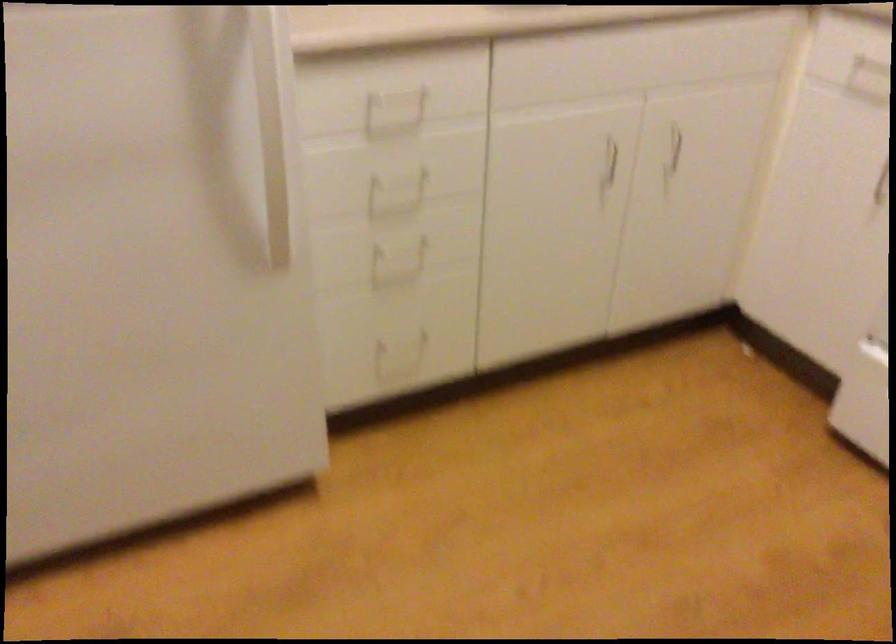
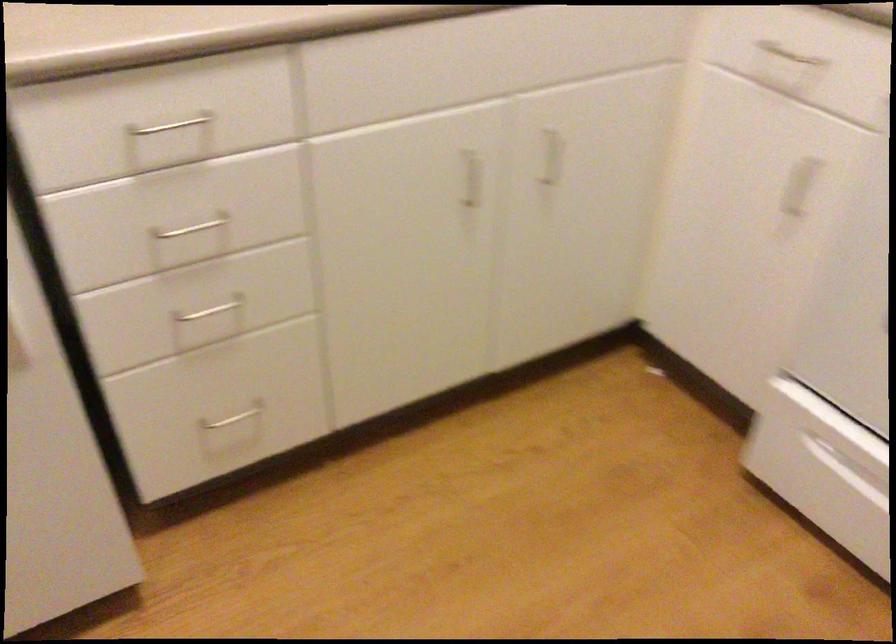
Question: The first image is from the beginning of the video and the second image is from the end. How did the camera likely rotate when shooting the video?

Choices:
 (A) Left
 (B) Right
 (C) Up
 (D) Down

Answer: (D)